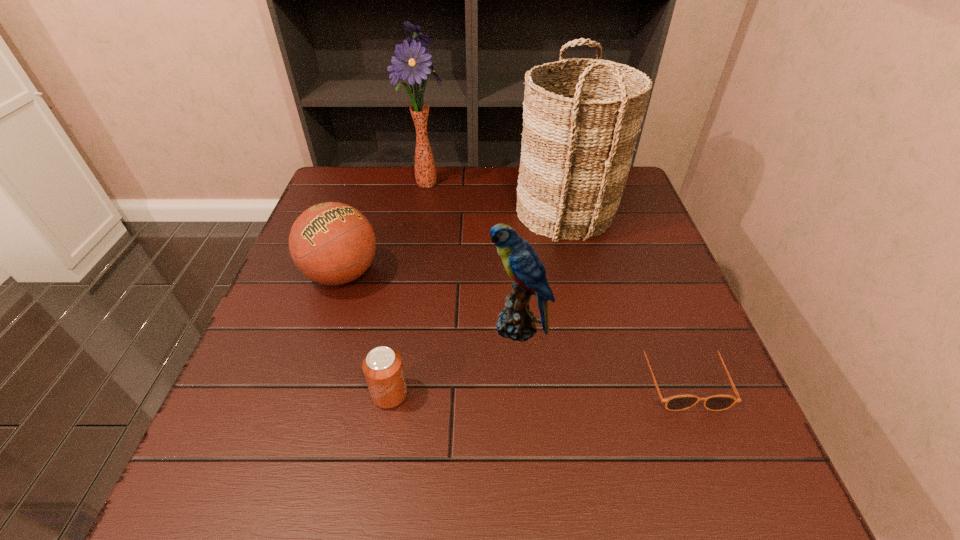
Identify the location of sunglasses that is at the right edge. (678, 402).

The height and width of the screenshot is (540, 960). In order to click on object that is at the far right corner in this screenshot , I will do `click(580, 124)`.

In the image, there is a desktop. What are the coordinates of `free space at the far edge` in the screenshot? It's located at (473, 190).

Find the location of `vacant position at the near edge of the desktop`. vacant position at the near edge of the desktop is located at coordinates (374, 474).

At what (x,y) coordinates should I click in order to perform the action: click on blank area at the left edge. Please return your answer as a coordinate pair (x, y). The image size is (960, 540). Looking at the image, I should click on pyautogui.click(x=288, y=335).

Image resolution: width=960 pixels, height=540 pixels. In order to click on blank space at the right edge in this screenshot , I will do `click(711, 361)`.

Locate an element on the screen. Image resolution: width=960 pixels, height=540 pixels. blank space at the far left corner of the desktop is located at coordinates (337, 167).

Locate an element on the screen. This screenshot has width=960, height=540. vacant point located between the shortest object and the basket is located at coordinates (624, 294).

Where is `empty space that is in between the second shortest object and the fourth nearest object`? This screenshot has height=540, width=960. empty space that is in between the second shortest object and the fourth nearest object is located at coordinates (366, 334).

Where is `empty location between the third nearest object and the basketball`? empty location between the third nearest object and the basketball is located at coordinates (430, 300).